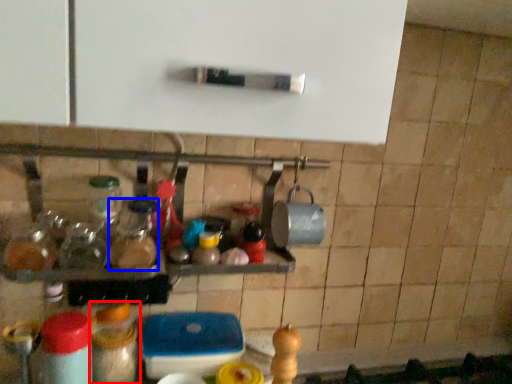
Question: Which of the following is the farthest to the observer, bottle (highlighted by a red box) or bottle (highlighted by a blue box)?

Choices:
 (A) bottle
 (B) bottle

Answer: (A)